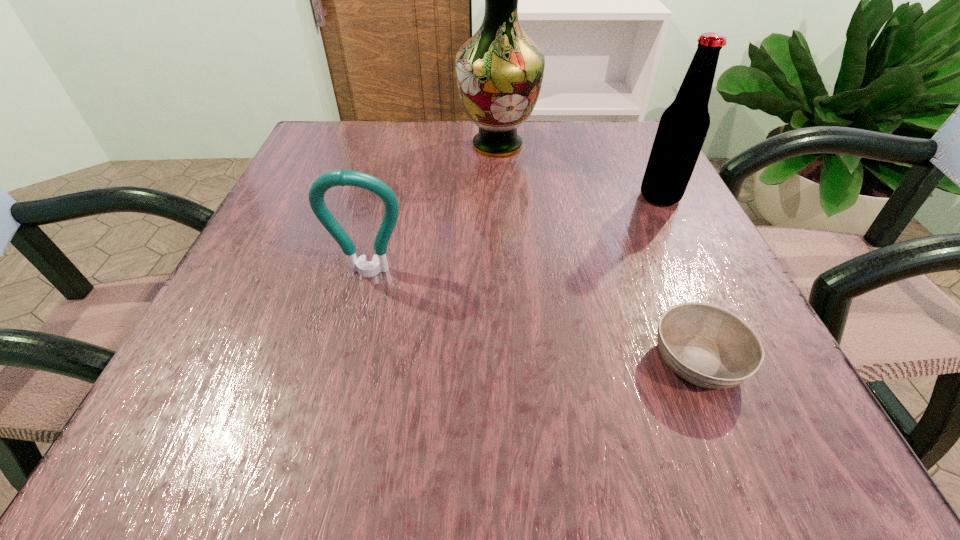
I want to click on blank region between the bowl and the third tallest object, so click(533, 316).

Identify the location of free space between the nearest object and the third farthest object. (533, 316).

Locate an element on the screen. This screenshot has height=540, width=960. free space between the vase and the shortest object is located at coordinates (597, 253).

Identify the location of object identified as the closest to the second nearest object. The width and height of the screenshot is (960, 540). (499, 71).

The height and width of the screenshot is (540, 960). What are the coordinates of `the second closest object relative to the second tallest object` in the screenshot? It's located at click(708, 346).

Find the location of `blank space that satisfies the following two spatial constraints: 1. on the front side of the vase; 2. on the right side of the shortest object`. blank space that satisfies the following two spatial constraints: 1. on the front side of the vase; 2. on the right side of the shortest object is located at coordinates (510, 361).